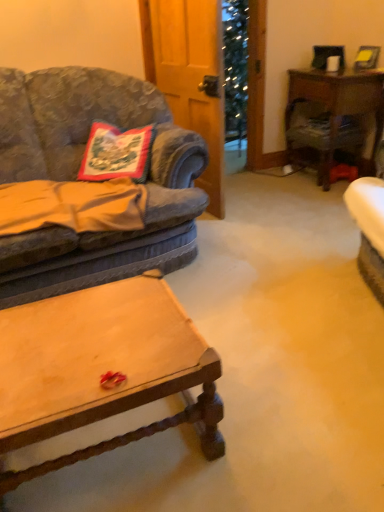
I want to click on free point above wooden coffee table at center (from a real-world perspective), so click(x=80, y=340).